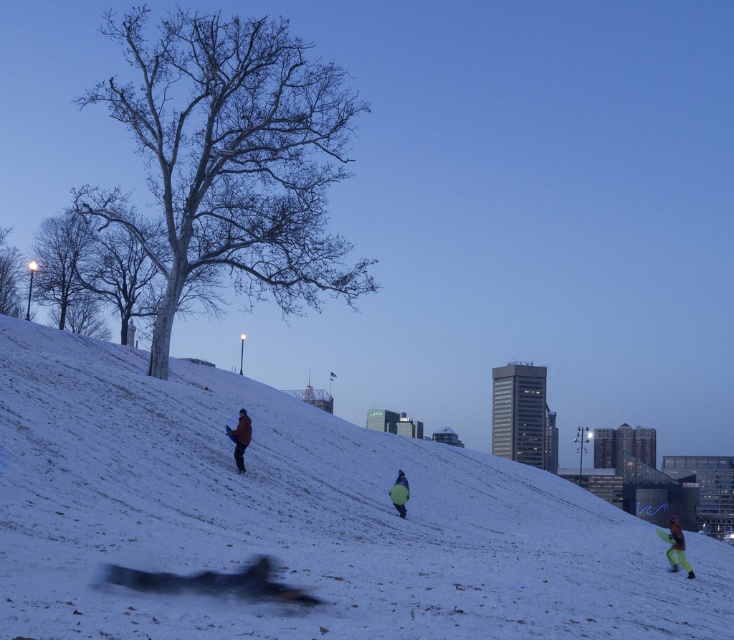
Question: Which point is closer to the camera?

Choices:
 (A) (675, 547)
 (B) (390, 492)

Answer: (A)

Question: Which object is the closest to the green fabric pants at lower right?

Choices:
 (A) smooth gray tree at upper left
 (B) yellow fabric jacket at center

Answer: (B)

Question: Among these points, which one is nearest to the camera?

Choices:
 (A) (10, 256)
 (B) (401, 486)
 (C) (243, 150)
 (D) (54, 230)

Answer: (B)

Question: In this image, where is white snow at center located relative to dark blue snowsuit at center?

Choices:
 (A) above
 (B) below

Answer: (B)

Question: In this image, where is bare wood tree at left located relative to green fabric pants at lower right?

Choices:
 (A) below
 (B) above

Answer: (B)

Question: Does smooth white tree at upper left have a smaller size compared to dark blue snowsuit at center?

Choices:
 (A) yes
 (B) no

Answer: (B)